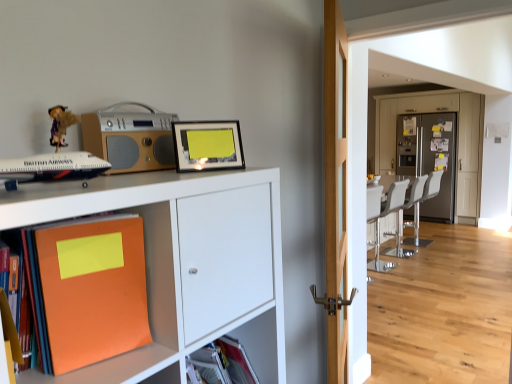
Question: Is metallic gray refrigerator at center next to matte black picture frame at upper center?

Choices:
 (A) no
 (B) yes

Answer: (A)

Question: Could you tell me if metallic gray refrigerator at center is facing matte black picture frame at upper center?

Choices:
 (A) yes
 (B) no

Answer: (A)

Question: From a real-world perspective, does metallic gray refrigerator at center stand above matte black picture frame at upper center?

Choices:
 (A) no
 (B) yes

Answer: (A)

Question: From the image's perspective, is metallic gray refrigerator at center located above matte black picture frame at upper center?

Choices:
 (A) no
 (B) yes

Answer: (A)

Question: Is metallic gray refrigerator at center taller than matte black picture frame at upper center?

Choices:
 (A) no
 (B) yes

Answer: (B)

Question: Is light wood door at center taller or shorter than white leather chair at right?

Choices:
 (A) tall
 (B) short

Answer: (A)

Question: Is light wood door at center wider or thinner than white leather chair at right?

Choices:
 (A) wide
 (B) thin

Answer: (B)

Question: Relative to white leather chair at right, is light wood door at center in front or behind?

Choices:
 (A) behind
 (B) front

Answer: (B)

Question: Considering the positions of point (327, 92) and point (402, 182), is point (327, 92) closer or farther from the camera than point (402, 182)?

Choices:
 (A) closer
 (B) farther

Answer: (A)

Question: Considering the positions of silver metallic stereo at upper left and white leather swivel chair at center in the image, is silver metallic stereo at upper left bigger or smaller than white leather swivel chair at center?

Choices:
 (A) big
 (B) small

Answer: (B)

Question: Choose the correct answer: Is silver metallic stereo at upper left inside white leather swivel chair at center or outside it?

Choices:
 (A) inside
 (B) outside

Answer: (B)

Question: From the image's perspective, is silver metallic stereo at upper left above or below white leather swivel chair at center?

Choices:
 (A) above
 (B) below

Answer: (A)

Question: From a real-world perspective, is silver metallic stereo at upper left physically located above or below white leather swivel chair at center?

Choices:
 (A) below
 (B) above

Answer: (B)

Question: Choose the correct answer: Is white leather swivel chair at center inside silver metallic stereo at upper left or outside it?

Choices:
 (A) inside
 (B) outside

Answer: (B)

Question: Is white leather swivel chair at center in front of or behind silver metallic stereo at upper left in the image?

Choices:
 (A) front
 (B) behind

Answer: (B)